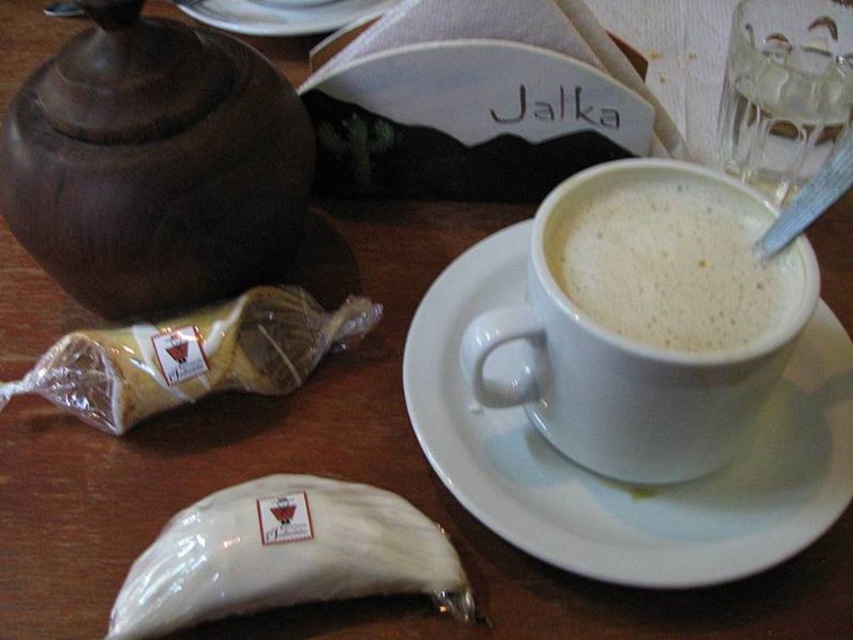
You are a customer at the cafe and want to pour tea from the brown matte teapot at left into your cup. Where should you move the teapot to ensure the tea flows into the cup without spilling?

The brown matte teapot at left is located at coordinates (154, 164), so you should move it to the position of the cup to pour the tea into it.

You are a barista trying to arrange the white glossy pastry at lower left and the white frothy coffee at center on a shelf. Which item should you place higher up to prevent the shorter one from blocking the view of the taller one?

The white glossy pastry at lower left is shorter than the white frothy coffee at center, so place the white glossy pastry at lower left lower and the white frothy coffee at center higher to ensure the taller item is visible.

You are a barista preparing to pack the white glossy pastry at lower left and the white frothy coffee at center for a customer. The customer wants the smaller item placed on top. Which item should you place on top?

The white glossy pastry at lower left has a smaller size compared to the white frothy coffee at center, so you should place the white glossy pastry at lower left on top.